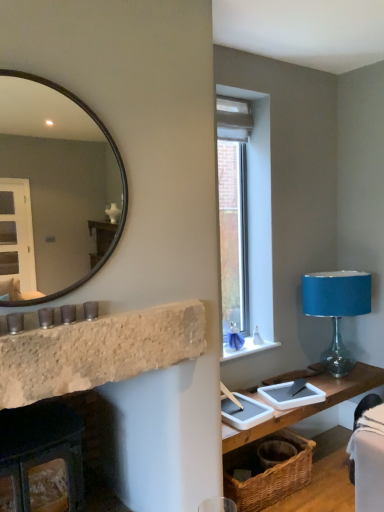
This screenshot has height=512, width=384. What are the coordinates of `vacant point above rustic stone fireplace at left, the second fireplace when ordered from bottom to top (from a real-world perspective)` in the screenshot? It's located at (116, 310).